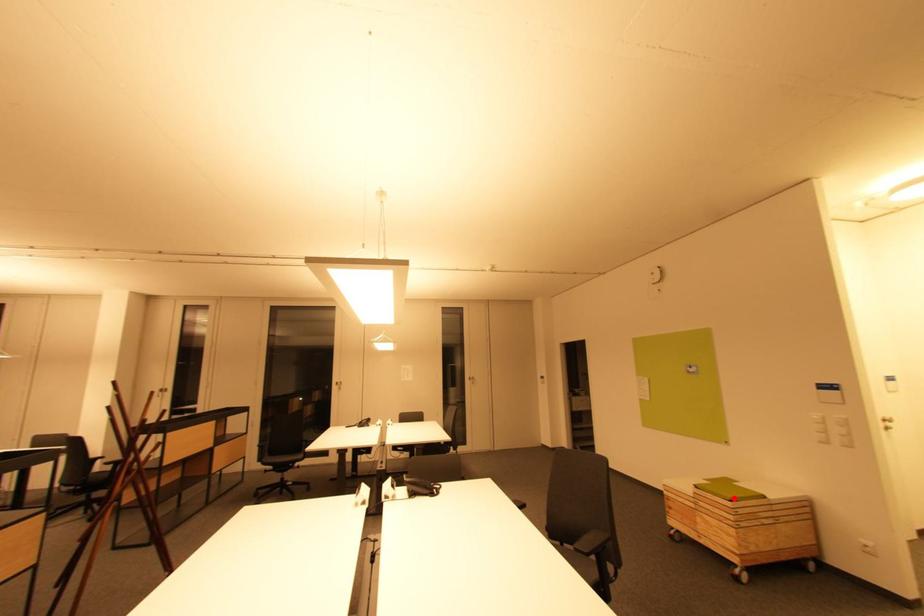
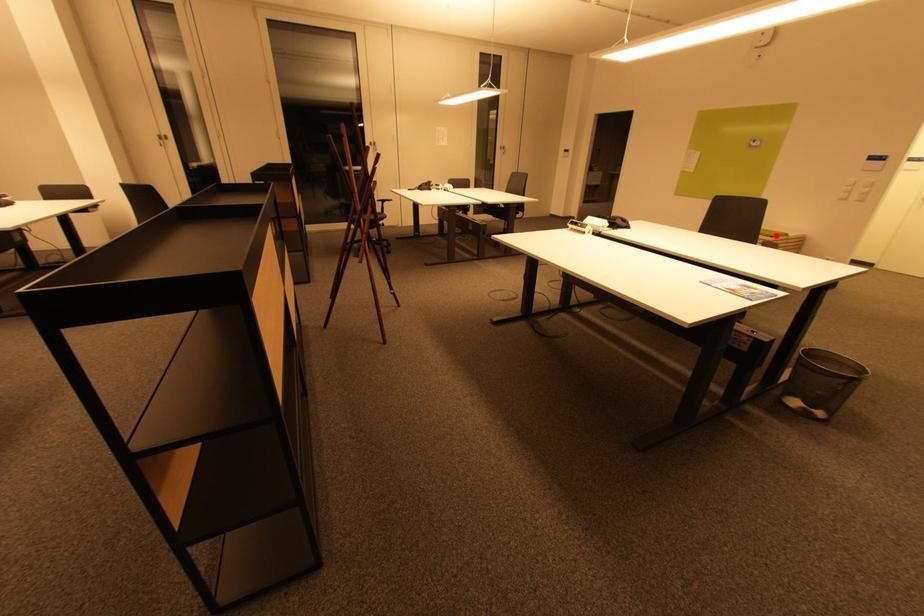
I am providing you with two images of the same scene from different viewpoints. A red point is marked on the first image and another point is marked on the second image. Are the points marked in image1 and image2 representing the same 3D position?

Yes